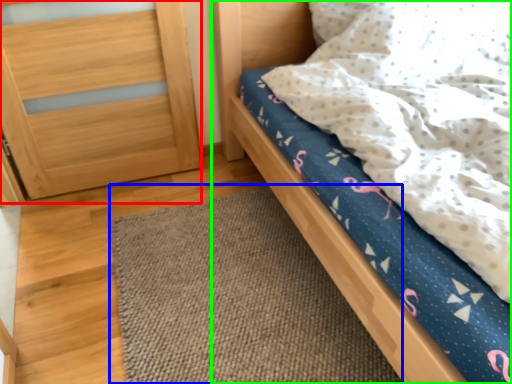
Question: Estimate the real-world distances between objects in this image. Which object is closer to balustrade (highlighted by a red box), mat (highlighted by a blue box) or bed (highlighted by a green box)?

Choices:
 (A) mat
 (B) bed

Answer: (B)